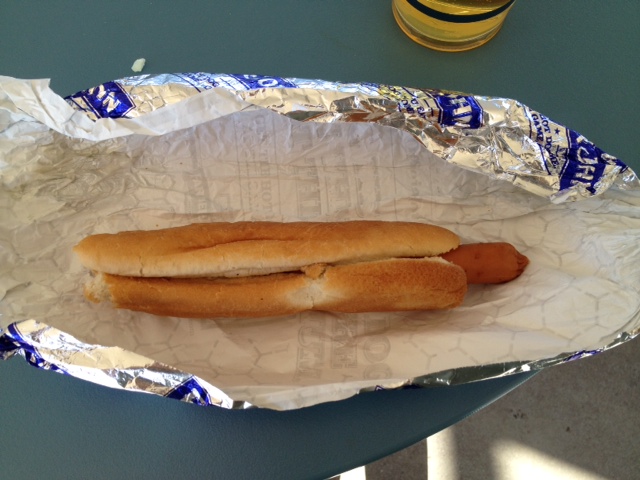
The image size is (640, 480). In order to click on drink cup in this screenshot , I will do `click(609, 336)`.